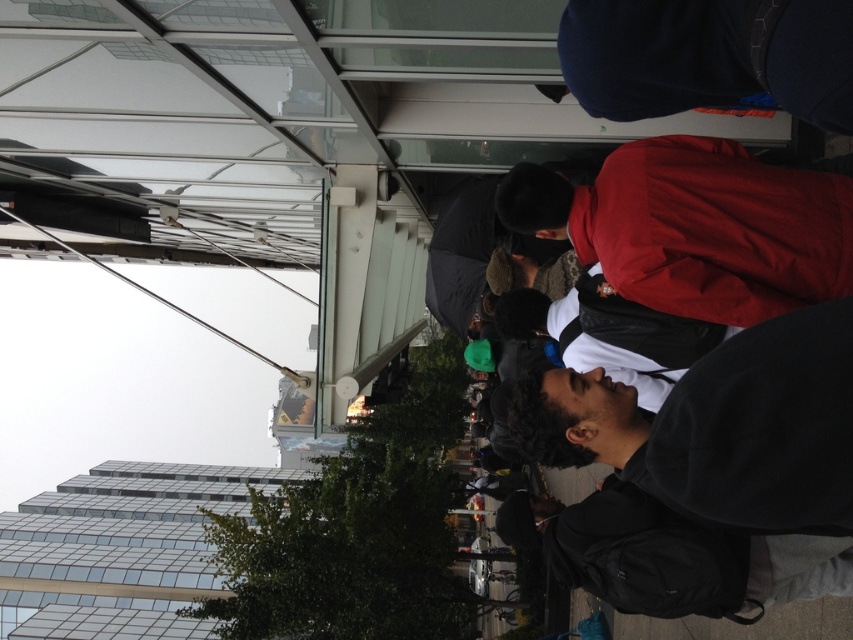
Question: Estimate the real-world distances between objects in this image. Which object is closer to the dark gray backpack at center?

Choices:
 (A) black matte jacket at lower right
 (B) red matte jacket at center

Answer: (B)

Question: Is red matte jacket at center thinner than dark gray backpack at center?

Choices:
 (A) no
 (B) yes

Answer: (A)

Question: Is black matte jacket at lower right closer to camera compared to red matte jacket at center?

Choices:
 (A) yes
 (B) no

Answer: (A)

Question: Is black matte jacket at lower right further to the viewer compared to red matte jacket at center?

Choices:
 (A) no
 (B) yes

Answer: (A)

Question: Which point is farther to the camera?

Choices:
 (A) dark gray backpack at center
 (B) red matte jacket at center
 (C) black matte jacket at lower right

Answer: (B)

Question: Estimate the real-world distances between objects in this image. Which object is farther from the black matte jacket at lower right?

Choices:
 (A) red matte jacket at center
 (B) dark gray backpack at center

Answer: (B)